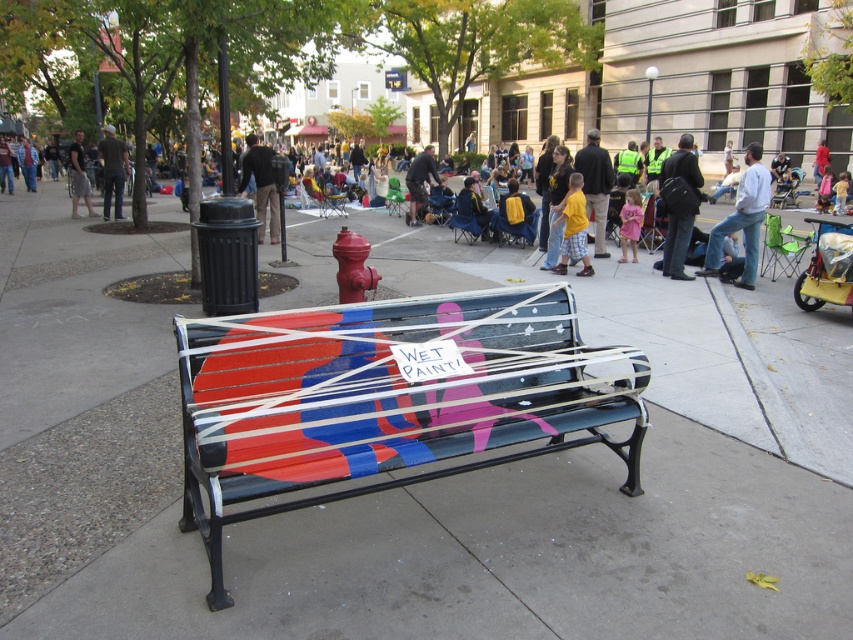
Does point (265, 566) come closer to viewer compared to point (552, 284)?

Yes, point (265, 566) is closer to viewer.

Is smooth concrete bench at center further to the viewer compared to glossy painted bench at center?

That is True.

Locate an element on the screen. The width and height of the screenshot is (853, 640). smooth concrete bench at center is located at coordinates (419, 484).

Is glossy painted bench at center further to camera compared to red fabric jacket at center?

No, glossy painted bench at center is closer to the viewer.

Who is positioned more to the left, glossy painted bench at center or red fabric jacket at center?

Positioned to the left is glossy painted bench at center.

Locate an element on the screen. glossy painted bench at center is located at coordinates (387, 397).

Does light blue jeans at right appear under light brown hair at center?

Yes.

Between light blue jeans at right and light brown hair at center, which one appears on the right side from the viewer's perspective?

light brown hair at center

Which is behind, point (755, 161) or point (833, 186)?

The point (833, 186) is behind.

At what (x,y) coordinates should I click in order to perform the action: click on light blue jeans at right. Please return your answer as a coordinate pair (x, y). The height and width of the screenshot is (640, 853). Looking at the image, I should click on (741, 218).